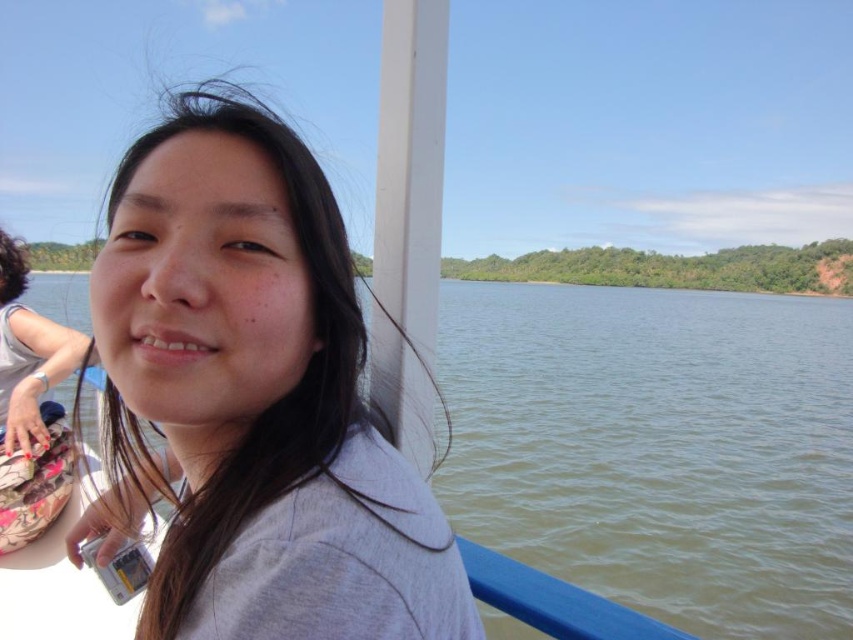
Between point (273, 280) and point (718, 477), which one is positioned behind?

Point (718, 477)

Does gray matte shirt at upper left have a lesser width compared to green water at center?

Yes.

Between point (297, 323) and point (695, 465), which one is positioned in front?

Positioned in front is point (297, 323).

This screenshot has width=853, height=640. I want to click on gray matte shirt at upper left, so click(253, 400).